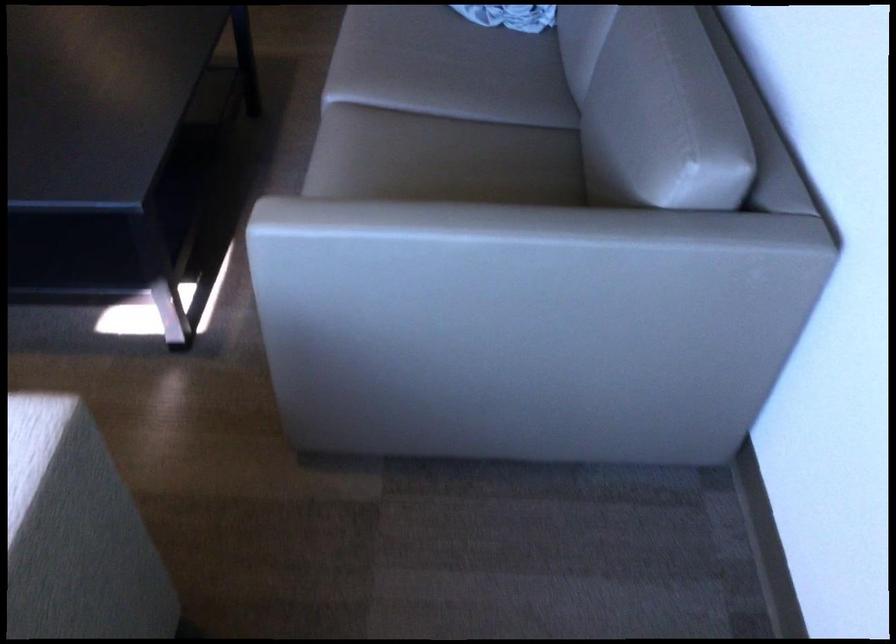
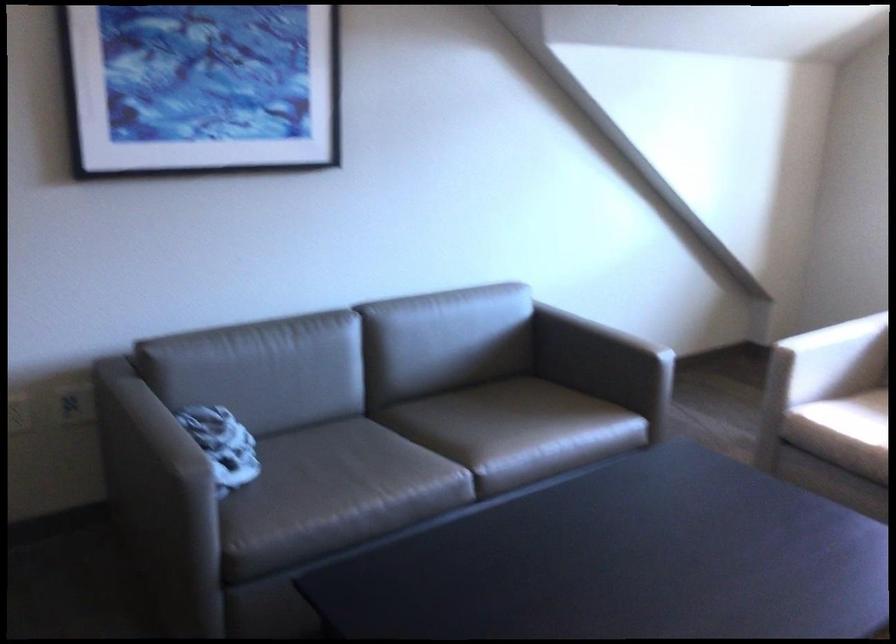
Find the pixel in the second image that matches pixel 381 152 in the first image.

(497, 430)